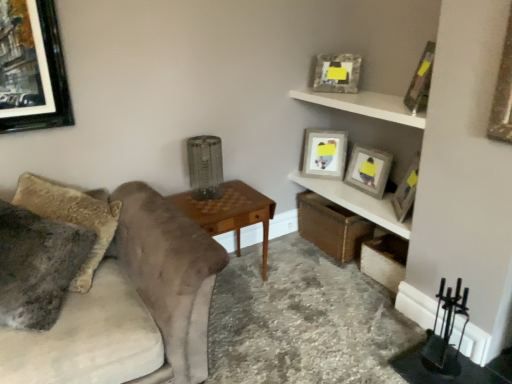
Where is `empty space that is ontop of woodenobject at center`? This screenshot has height=384, width=512. empty space that is ontop of woodenobject at center is located at coordinates (223, 207).